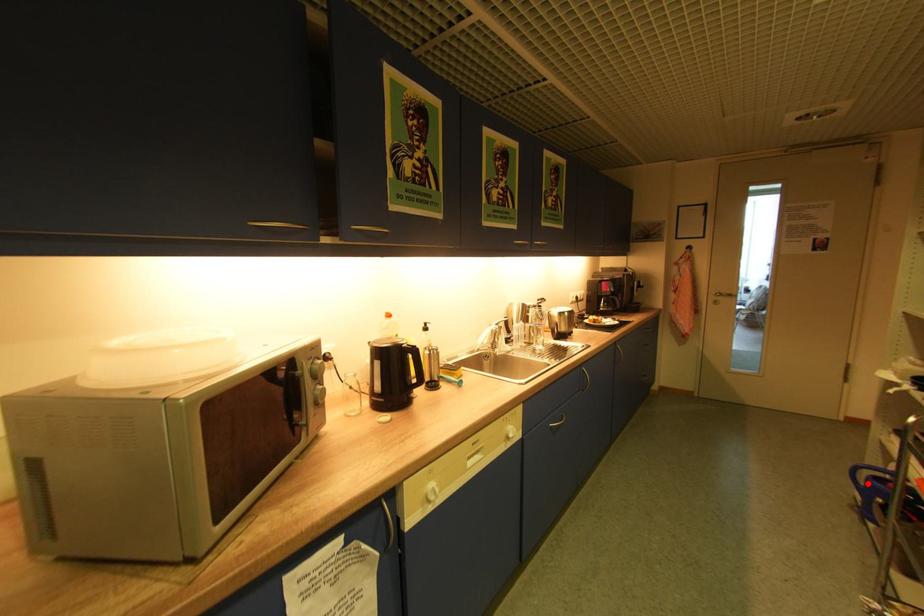
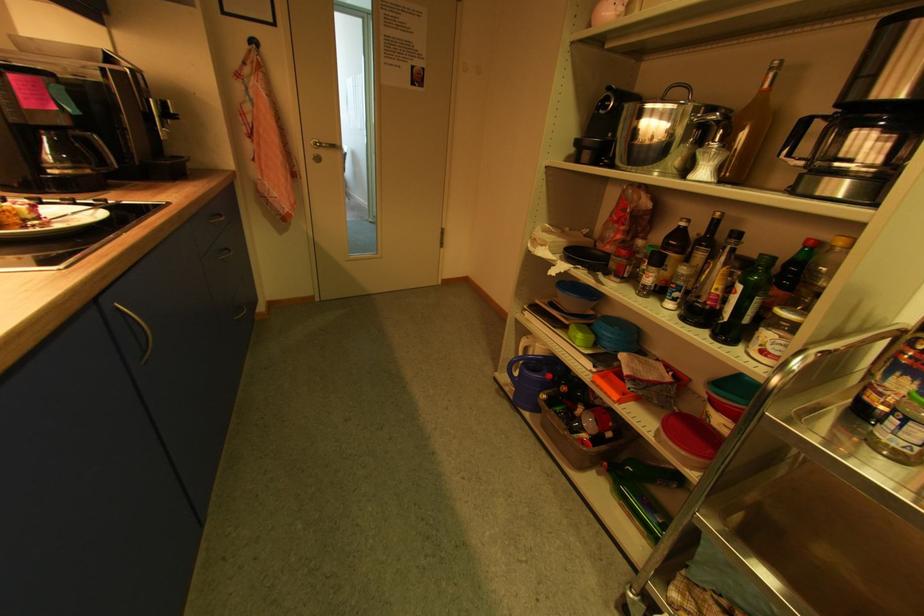
Question: I am providing you with two images of the same scene from different viewpoints. Image1 has a red point marked. In image2, the corresponding 3D location appears at what relative position? Reply with the corresponding letter.

Choices:
 (A) Closer
 (B) Farther

Answer: (A)